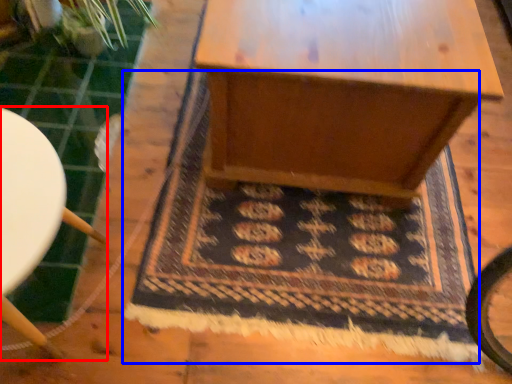
Question: Which object appears closest to the camera in this image, furniture (highlighted by a red box) or mat (highlighted by a blue box)?

Choices:
 (A) furniture
 (B) mat

Answer: (A)